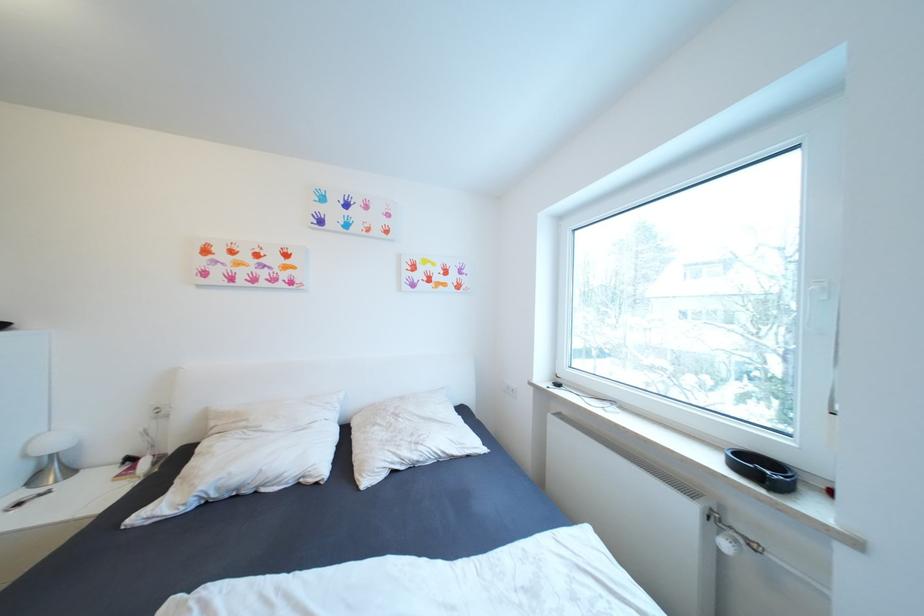
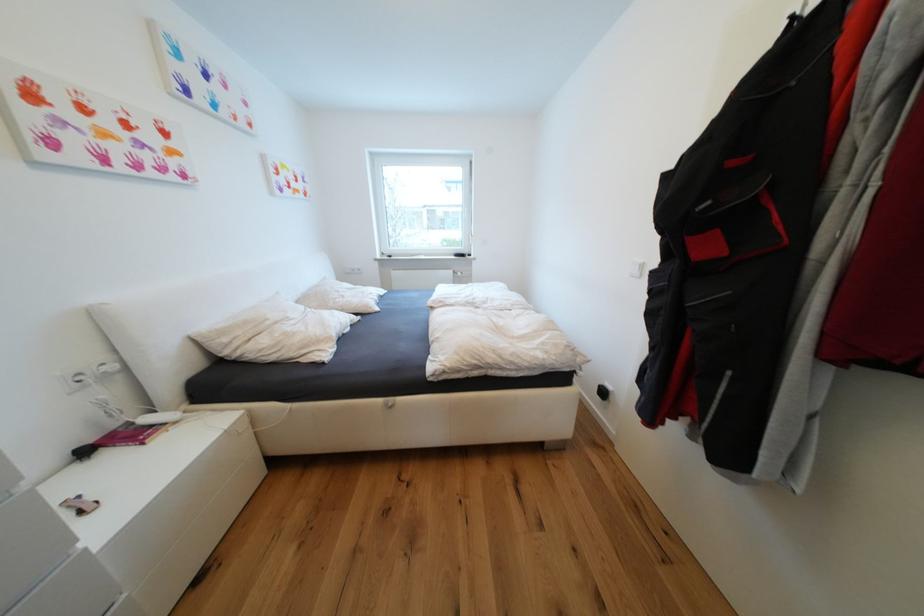
In the second image, find the point that corresponds to point 397,427 in the first image.

(349, 297)